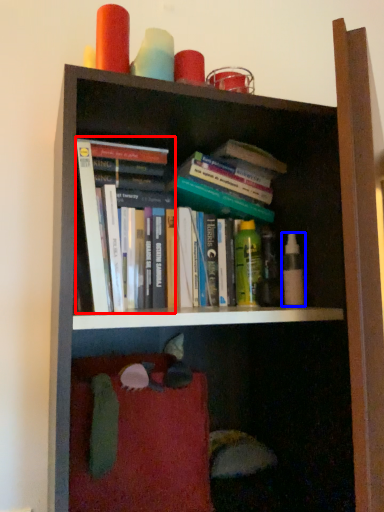
Question: Which point is closer to the camera, book (highlighted by a red box) or toiletry (highlighted by a blue box)?

Choices:
 (A) book
 (B) toiletry

Answer: (A)